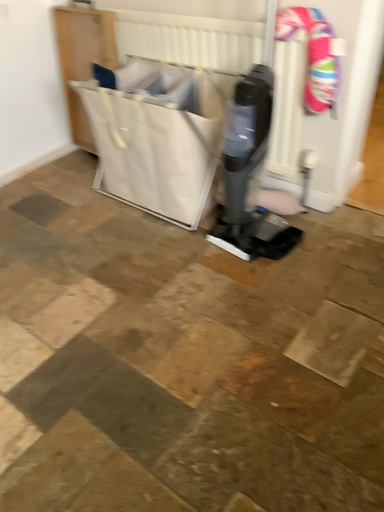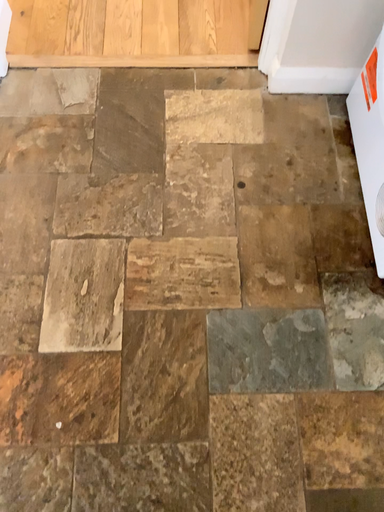
Question: Which way did the camera rotate in the video?

Choices:
 (A) rotated upward
 (B) rotated downward

Answer: (B)